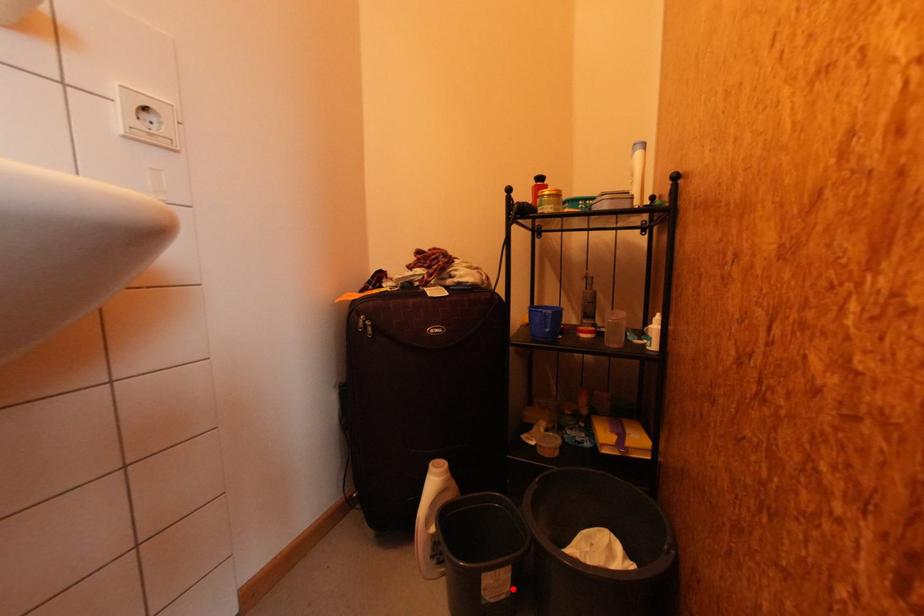
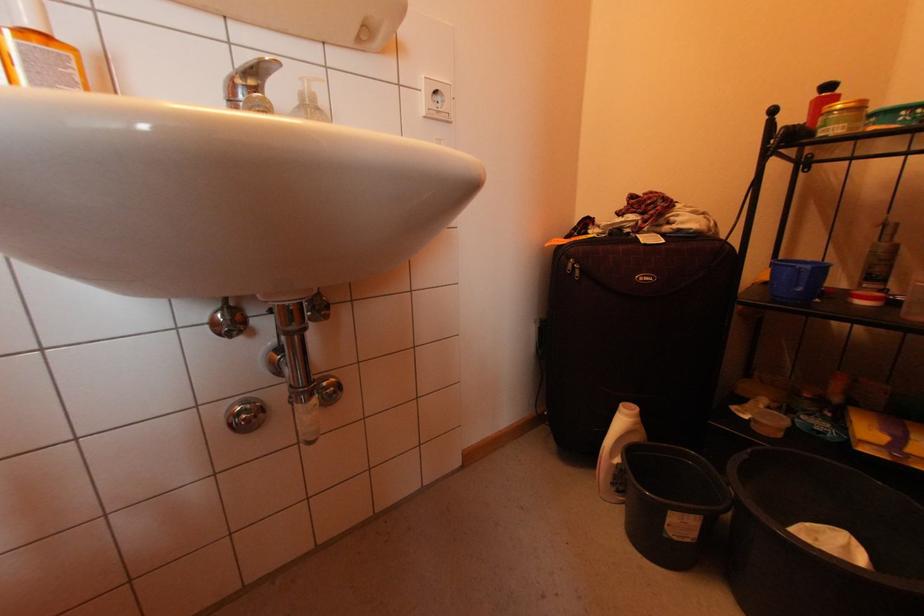
The point at the highlighted location is marked in the first image. Where is the corresponding point in the second image?

(699, 536)